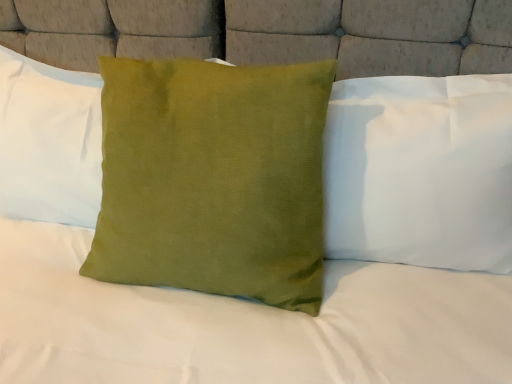
Question: In which direction should I rotate to look at green velvet pillow at center, the 3th pillow when ordered from right to left?

Choices:
 (A) right
 (B) left

Answer: (B)

Question: From a real-world perspective, is green velvet cushion at center, marked as the second pillow in a right-to-left arrangement, positioned over satin green pillow at center, arranged as the third pillow when viewed from the left, based on gravity?

Choices:
 (A) no
 (B) yes

Answer: (A)

Question: Is satin green pillow at center, arranged as the third pillow when viewed from the left, at the back of green velvet cushion at center, marked as the second pillow in a right-to-left arrangement?

Choices:
 (A) no
 (B) yes

Answer: (A)

Question: Does green velvet cushion at center, marked as the second pillow in a right-to-left arrangement, have a lesser width compared to satin green pillow at center, arranged as the third pillow when viewed from the left?

Choices:
 (A) yes
 (B) no

Answer: (B)

Question: Does green velvet cushion at center, marked as the second pillow in a right-to-left arrangement, appear on the right side of satin green pillow at center, arranged as the third pillow when viewed from the left?

Choices:
 (A) no
 (B) yes

Answer: (A)

Question: Does green velvet cushion at center, positioned as the 2th pillow in left-to-right order, turn towards satin green pillow at center, arranged as the third pillow when viewed from the left?

Choices:
 (A) no
 (B) yes

Answer: (A)

Question: Is green velvet cushion at center, positioned as the 2th pillow in left-to-right order, positioned beyond the bounds of satin green pillow at center, arranged as the third pillow when viewed from the left?

Choices:
 (A) yes
 (B) no

Answer: (A)

Question: Considering the relative positions of green velvet pillow at center, positioned as the first pillow in left-to-right order, and satin green pillow at center, placed as the 1th pillow when sorted from right to left, in the image provided, is green velvet pillow at center, positioned as the first pillow in left-to-right order, to the left of satin green pillow at center, placed as the 1th pillow when sorted from right to left, from the viewer's perspective?

Choices:
 (A) no
 (B) yes

Answer: (B)

Question: Is green velvet pillow at center, the 3th pillow when ordered from right to left, located outside satin green pillow at center, arranged as the third pillow when viewed from the left?

Choices:
 (A) yes
 (B) no

Answer: (A)

Question: Is green velvet pillow at center, positioned as the first pillow in left-to-right order, facing away from satin green pillow at center, placed as the 1th pillow when sorted from right to left?

Choices:
 (A) no
 (B) yes

Answer: (A)

Question: Is green velvet pillow at center, positioned as the first pillow in left-to-right order, shorter than satin green pillow at center, arranged as the third pillow when viewed from the left?

Choices:
 (A) yes
 (B) no

Answer: (A)

Question: Is the position of green velvet pillow at center, positioned as the first pillow in left-to-right order, less distant than that of satin green pillow at center, arranged as the third pillow when viewed from the left?

Choices:
 (A) no
 (B) yes

Answer: (A)

Question: Considering the relative sizes of green velvet pillow at center, the 3th pillow when ordered from right to left, and satin green pillow at center, arranged as the third pillow when viewed from the left, in the image provided, is green velvet pillow at center, the 3th pillow when ordered from right to left, taller than satin green pillow at center, arranged as the third pillow when viewed from the left,?

Choices:
 (A) no
 (B) yes

Answer: (A)

Question: Does satin green pillow at center, arranged as the third pillow when viewed from the left, lie behind green velvet cushion at center, marked as the second pillow in a right-to-left arrangement?

Choices:
 (A) yes
 (B) no

Answer: (A)